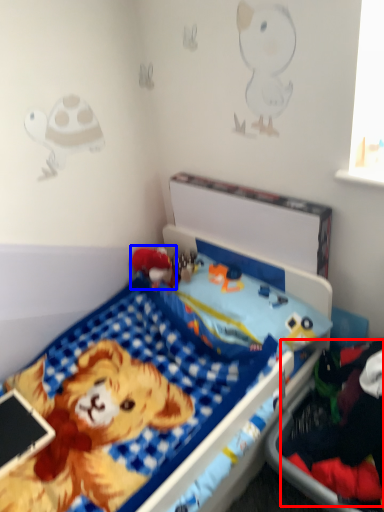
Question: Which of the following is the farthest to the observer, clothing (highlighted by a red box) or toy (highlighted by a blue box)?

Choices:
 (A) clothing
 (B) toy

Answer: (B)